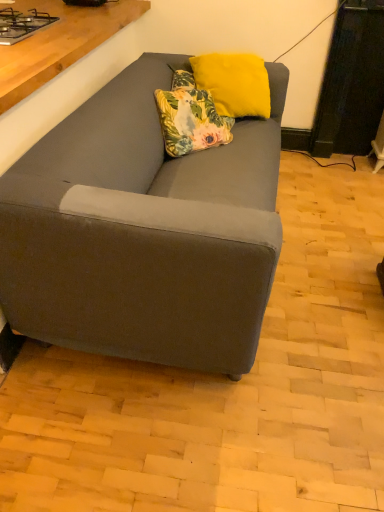
Describe the element at coordinates (190, 121) in the screenshot. I see `floral fabric pillow at center, placed as the 2th pillow when sorted from top to bottom` at that location.

Image resolution: width=384 pixels, height=512 pixels. What do you see at coordinates (22, 24) in the screenshot? I see `metallic gray gas stove at upper left` at bounding box center [22, 24].

I want to click on floral fabric pillow at center, placed as the 2th pillow when sorted from top to bottom, so click(x=190, y=121).

Who is shorter, floral fabric pillow at center, placed as the 2th pillow when sorted from top to bottom, or metallic gray gas stove at upper left?

Standing shorter between the two is metallic gray gas stove at upper left.

Is floral fabric pillow at center, placed as the 1th pillow when sorted from bottom to top, not within metallic gray gas stove at upper left?

That's correct, floral fabric pillow at center, placed as the 1th pillow when sorted from bottom to top, is outside of metallic gray gas stove at upper left.

From the image's perspective, who appears lower, floral fabric pillow at center, placed as the 2th pillow when sorted from top to bottom, or metallic gray gas stove at upper left?

floral fabric pillow at center, placed as the 2th pillow when sorted from top to bottom.

Identify the location of pillow in front of the yellow fuzzy pillow at upper center, which is the 1th pillow in top-to-bottom order. This screenshot has height=512, width=384. (190, 121).

Considering the sizes of objects yellow fuzzy pillow at upper center, the second pillow ordered from the bottom, and floral fabric pillow at center, placed as the 1th pillow when sorted from bottom to top, in the image provided, who is wider, yellow fuzzy pillow at upper center, the second pillow ordered from the bottom, or floral fabric pillow at center, placed as the 1th pillow when sorted from bottom to top,?

floral fabric pillow at center, placed as the 1th pillow when sorted from bottom to top, is wider.

Is yellow fuzzy pillow at upper center, the second pillow ordered from the bottom, smaller than floral fabric pillow at center, placed as the 1th pillow when sorted from bottom to top?

No.

From a real-world perspective, which is physically below, yellow fuzzy pillow at upper center, the second pillow ordered from the bottom, or floral fabric pillow at center, placed as the 1th pillow when sorted from bottom to top?

floral fabric pillow at center, placed as the 1th pillow when sorted from bottom to top.

Is metallic gray gas stove at upper left at the back of yellow fuzzy pillow at upper center, the second pillow ordered from the bottom?

That's not correct — yellow fuzzy pillow at upper center, the second pillow ordered from the bottom, is not looking away from metallic gray gas stove at upper left.

Is the position of yellow fuzzy pillow at upper center, which is the 1th pillow in top-to-bottom order, less distant than that of metallic gray gas stove at upper left?

No.

Looking at this image, is yellow fuzzy pillow at upper center, the second pillow ordered from the bottom, positioned far away from metallic gray gas stove at upper left?

They are positioned close to each other.

From a real-world perspective, is yellow fuzzy pillow at upper center, which is the 1th pillow in top-to-bottom order, below metallic gray gas stove at upper left?

Yes, from a real-world perspective, yellow fuzzy pillow at upper center, which is the 1th pillow in top-to-bottom order, is below metallic gray gas stove at upper left.

Is point (12, 36) more distant than point (210, 126)?

No, it is in front of (210, 126).

Can you confirm if metallic gray gas stove at upper left is thinner than floral fabric pillow at center, placed as the 2th pillow when sorted from top to bottom?

Incorrect, the width of metallic gray gas stove at upper left is not less than that of floral fabric pillow at center, placed as the 2th pillow when sorted from top to bottom.

Is the position of metallic gray gas stove at upper left more distant than that of floral fabric pillow at center, placed as the 1th pillow when sorted from bottom to top?

That is False.

How different are the orientations of metallic gray gas stove at upper left and floral fabric pillow at center, placed as the 1th pillow when sorted from bottom to top, in degrees?

metallic gray gas stove at upper left and floral fabric pillow at center, placed as the 1th pillow when sorted from bottom to top, are facing 125 degrees away from each other.

Is point (10, 14) closer or farther from the camera than point (241, 77)?

Point (10, 14) appears to be closer to the viewer than point (241, 77).

Is metallic gray gas stove at upper left not near yellow fuzzy pillow at upper center, the second pillow ordered from the bottom?

metallic gray gas stove at upper left is near yellow fuzzy pillow at upper center, the second pillow ordered from the bottom, not far away.

Does metallic gray gas stove at upper left turn towards yellow fuzzy pillow at upper center, which is the 1th pillow in top-to-bottom order?

No, metallic gray gas stove at upper left is not aimed at yellow fuzzy pillow at upper center, which is the 1th pillow in top-to-bottom order.

In terms of height, does floral fabric pillow at center, placed as the 2th pillow when sorted from top to bottom, look taller or shorter compared to yellow fuzzy pillow at upper center, the second pillow ordered from the bottom?

Clearly, floral fabric pillow at center, placed as the 2th pillow when sorted from top to bottom, is shorter compared to yellow fuzzy pillow at upper center, the second pillow ordered from the bottom.

Is floral fabric pillow at center, placed as the 2th pillow when sorted from top to bottom, to the left or to the right of yellow fuzzy pillow at upper center, the second pillow ordered from the bottom, in the image?

floral fabric pillow at center, placed as the 2th pillow when sorted from top to bottom, is to the left of yellow fuzzy pillow at upper center, the second pillow ordered from the bottom.

From the image's perspective, between floral fabric pillow at center, placed as the 1th pillow when sorted from bottom to top, and yellow fuzzy pillow at upper center, which is the 1th pillow in top-to-bottom order, who is located below?

floral fabric pillow at center, placed as the 1th pillow when sorted from bottom to top.

Does floral fabric pillow at center, placed as the 1th pillow when sorted from bottom to top, come in front of yellow fuzzy pillow at upper center, the second pillow ordered from the bottom?

Yes, it is.

Where is `gas stove above the floral fabric pillow at center, placed as the 1th pillow when sorted from bottom to top (from a real-world perspective)`? The height and width of the screenshot is (512, 384). gas stove above the floral fabric pillow at center, placed as the 1th pillow when sorted from bottom to top (from a real-world perspective) is located at coordinates (22, 24).

Identify the location of pillow behind the floral fabric pillow at center, placed as the 1th pillow when sorted from bottom to top. This screenshot has width=384, height=512. (234, 83).

From the image, which object appears to be nearer to floral fabric pillow at center, placed as the 2th pillow when sorted from top to bottom, yellow fuzzy pillow at upper center, which is the 1th pillow in top-to-bottom order, or metallic gray gas stove at upper left?

The object closer to floral fabric pillow at center, placed as the 2th pillow when sorted from top to bottom, is yellow fuzzy pillow at upper center, which is the 1th pillow in top-to-bottom order.

Considering their positions, is floral fabric pillow at center, placed as the 1th pillow when sorted from bottom to top, positioned closer to metallic gray gas stove at upper left than yellow fuzzy pillow at upper center, which is the 1th pillow in top-to-bottom order?

floral fabric pillow at center, placed as the 1th pillow when sorted from bottom to top.

Based on their spatial positions, is metallic gray gas stove at upper left or yellow fuzzy pillow at upper center, which is the 1th pillow in top-to-bottom order, closer to floral fabric pillow at center, placed as the 1th pillow when sorted from bottom to top?

yellow fuzzy pillow at upper center, which is the 1th pillow in top-to-bottom order, is closer to floral fabric pillow at center, placed as the 1th pillow when sorted from bottom to top.

Which object lies nearer to the anchor point metallic gray gas stove at upper left, yellow fuzzy pillow at upper center, the second pillow ordered from the bottom, or floral fabric pillow at center, placed as the 2th pillow when sorted from top to bottom?

Among the two, floral fabric pillow at center, placed as the 2th pillow when sorted from top to bottom, is located nearer to metallic gray gas stove at upper left.

When comparing their distances from yellow fuzzy pillow at upper center, the second pillow ordered from the bottom, does metallic gray gas stove at upper left or floral fabric pillow at center, placed as the 1th pillow when sorted from bottom to top, seem closer?

floral fabric pillow at center, placed as the 1th pillow when sorted from bottom to top, is positioned closer to the anchor yellow fuzzy pillow at upper center, the second pillow ordered from the bottom.

Estimate the real-world distances between objects in this image. Which object is closer to yellow fuzzy pillow at upper center, the second pillow ordered from the bottom, floral fabric pillow at center, placed as the 1th pillow when sorted from bottom to top, or metallic gray gas stove at upper left?

floral fabric pillow at center, placed as the 1th pillow when sorted from bottom to top, is positioned closer to the anchor yellow fuzzy pillow at upper center, the second pillow ordered from the bottom.

Locate an element on the screen. Image resolution: width=384 pixels, height=512 pixels. pillow between metallic gray gas stove at upper left and yellow fuzzy pillow at upper center, which is the 1th pillow in top-to-bottom order, in the horizontal direction is located at coordinates (190, 121).